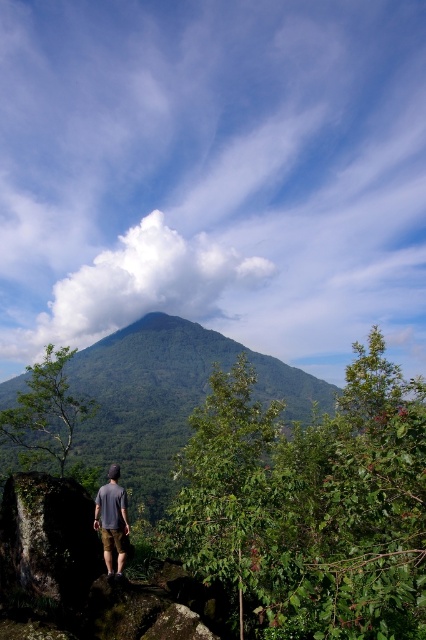
You are standing at the base of the green leafy mountain at center and want to take a photo of the gray cotton shirt at center. Which direction should you move to get the shirt in your camera frame?

Since the green leafy mountain at center is to the left of the gray cotton shirt at center, you should move to the right to position the shirt within your camera frame.

You are planning to take a photo of the green leafy mountain at center and the gray cotton shirt at center from your current position. Which object will appear larger in the photo?

The green leafy mountain at center will appear larger in the photo because it is much taller than the gray cotton shirt at center.